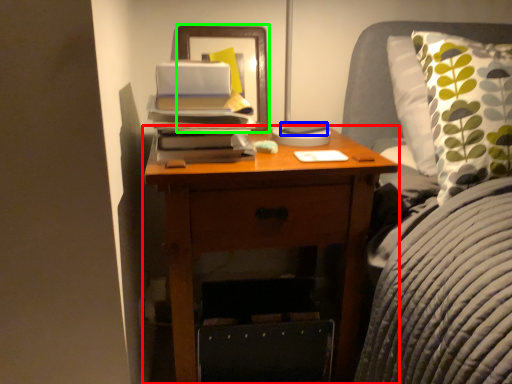
Question: Estimate the real-world distances between objects in this image. Which object is closer to nightstand (highlighted by a red box), paperback book (highlighted by a blue box) or picture frame (highlighted by a green box)?

Choices:
 (A) paperback book
 (B) picture frame

Answer: (B)